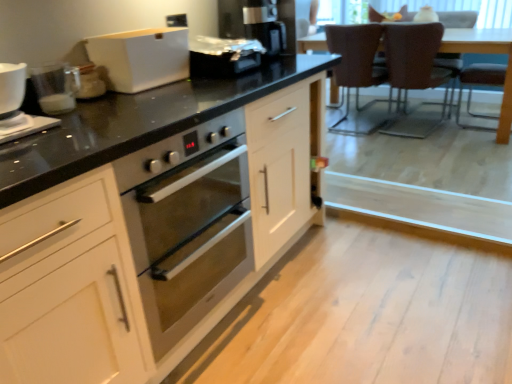
Question: Does point (461, 19) appear closer or farther from the camera than point (471, 46)?

Choices:
 (A) closer
 (B) farther

Answer: (B)

Question: Considering the relative positions of brown leather armchair at upper right, which is counted as the second armchair, starting from the front, and brown leather armchair at right, placed as the 1th armchair when sorted from front to back, in the image provided, is brown leather armchair at upper right, which is counted as the second armchair, starting from the front, to the left or to the right of brown leather armchair at right, placed as the 1th armchair when sorted from front to back,?

Choices:
 (A) left
 (B) right

Answer: (A)

Question: Based on their relative distances, which object is nearer to the brown leather chair at upper right, which is the second chair in left-to-right order?

Choices:
 (A) brown leather chair at upper right, which is counted as the 2th chair, starting from the right
 (B) brown leather armchair at right, placed as the 1th armchair when sorted from front to back
 (C) white matte bread bin at upper center
 (D) brown leather armchair at upper right, marked as the 1th armchair in a back-to-front arrangement
 (E) white glossy mug at left

Answer: (A)

Question: Which is farther from the white glossy mug at left?

Choices:
 (A) white glossy plate at left, the first appliance when ordered from front to back
 (B) brown leather chair at upper right, which is the second chair in left-to-right order
 (C) satin black toaster at upper center, which appears as the first appliance when viewed from the top
 (D) brown leather chair at upper right, which is counted as the 2th chair, starting from the right
 (E) white matte cabinet at center

Answer: (B)